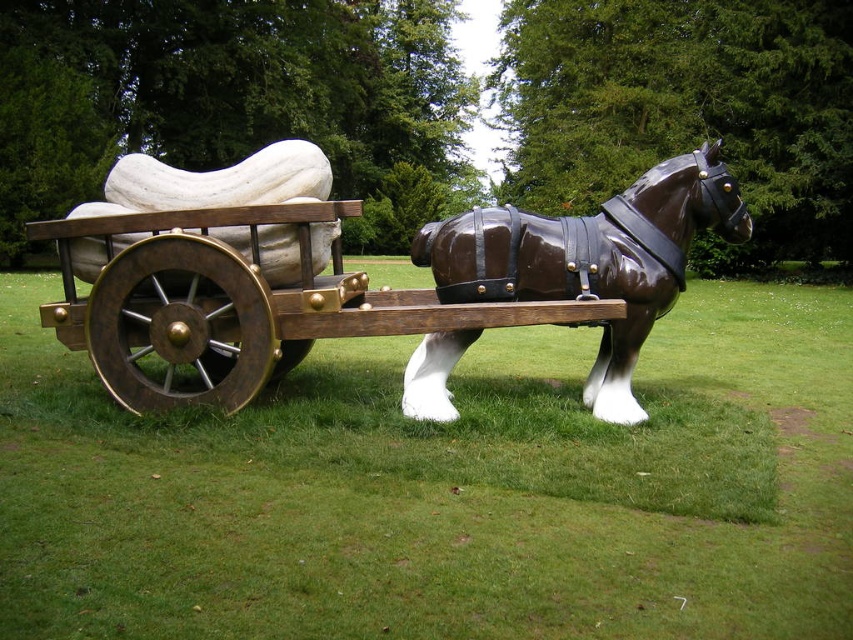
Consider the image. You are standing in front of the sculpture of the horse and cart. There are two points marked on the sculpture. One is at coordinate point (277, 545) and the other at point (212, 355). Which point is closer to you?

Point (277, 545) is closer to the viewer than point (212, 355).

You are standing at the base of the sculpture of the horse pulling the cart. Looking down, you notice a point marked at coordinates [445,490]. What is the color of the ground at this point?

The point at [445,490] marks green grass at lower center, so the ground there is green.